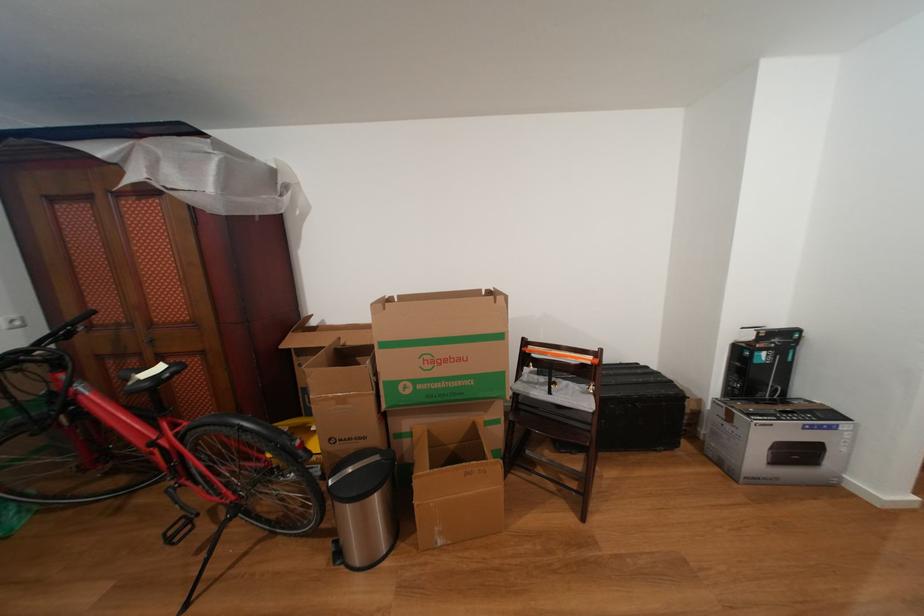
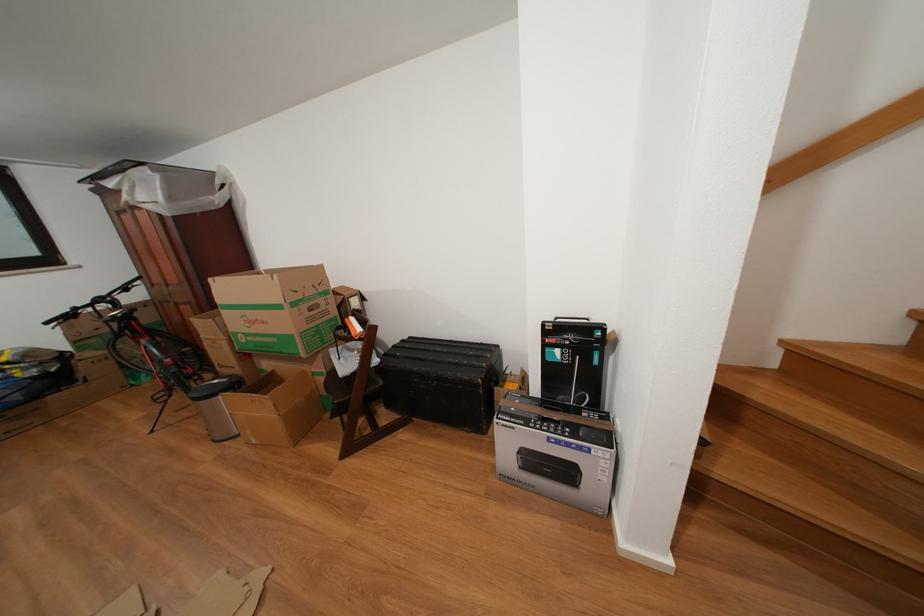
Where in the second image is the point corresponding to point (629, 369) from the first image?

(490, 349)